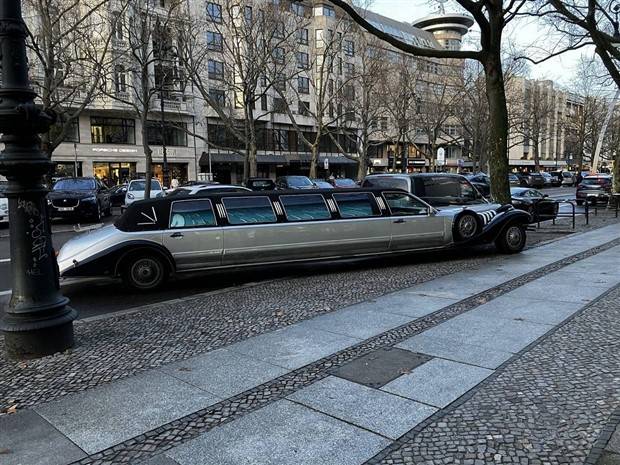
Identify the location of backdoor handle. (175, 237).